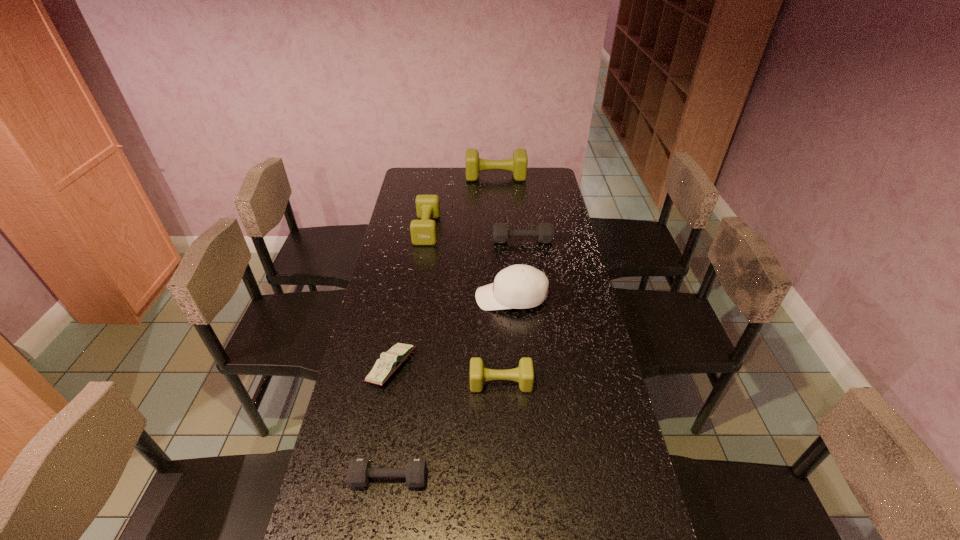
Locate an element on the screen. The image size is (960, 540). the nearer gray dumbbell is located at coordinates (359, 472).

Locate an element on the screen. This screenshot has height=540, width=960. the left gray dumbbell is located at coordinates pos(359,472).

Where is `diary`? The image size is (960, 540). diary is located at coordinates (388, 363).

Where is `pink diary`? The width and height of the screenshot is (960, 540). pink diary is located at coordinates (388, 363).

Locate an element on the screen. The width and height of the screenshot is (960, 540). free region located 0.300m on the left of the farthest dumbbell is located at coordinates (407, 177).

Identify the location of free point located 0.050m on the front-facing side of the fourth nearest object. (461, 298).

What are the coordinates of `vacant region located on the front-facing side of the fourth nearest object` in the screenshot? It's located at (442, 298).

At what (x,y) coordinates should I click in order to perform the action: click on free space located on the front-facing side of the fourth nearest object. Please return your answer as a coordinate pair (x, y). The image size is (960, 540). Looking at the image, I should click on (421, 298).

Where is `free space located on the front of the second nearest olive dumbbell`? free space located on the front of the second nearest olive dumbbell is located at coordinates (414, 309).

You are a GUI agent. You are given a task and a screenshot of the screen. Output one action in this format:
    pyautogui.click(x=<x>, y=<y>)
    Task: Click on the vacant area located 0.130m on the front of the farther gray dumbbell
    The image size is (960, 540).
    Given the screenshot: What is the action you would take?
    pyautogui.click(x=526, y=267)